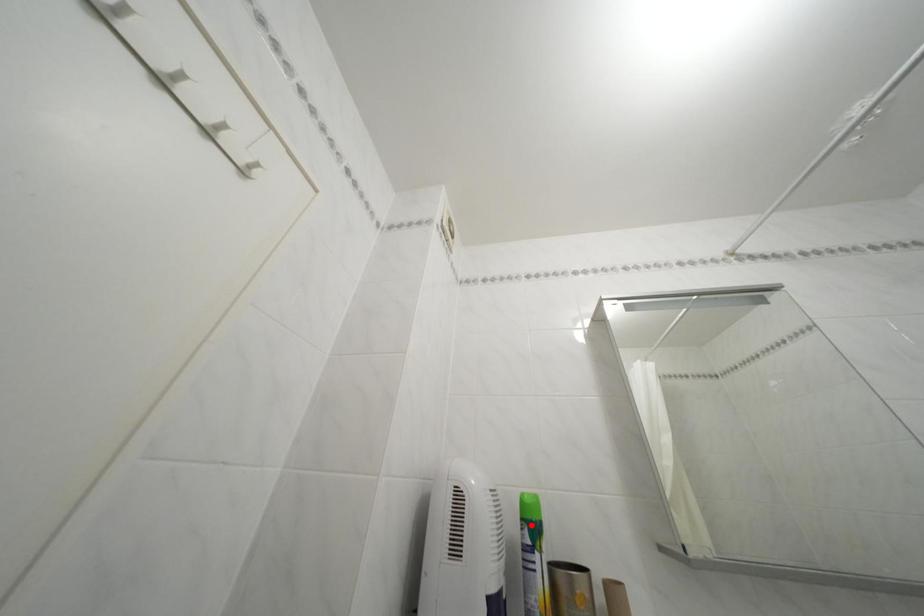
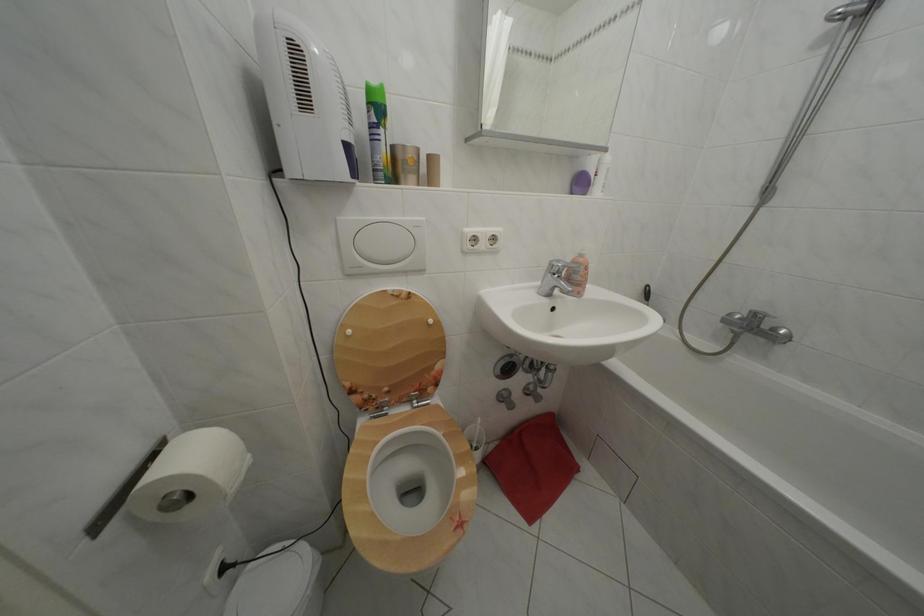
The point at the highlighted location is marked in the first image. Where is the corresponding point in the second image?

(378, 110)